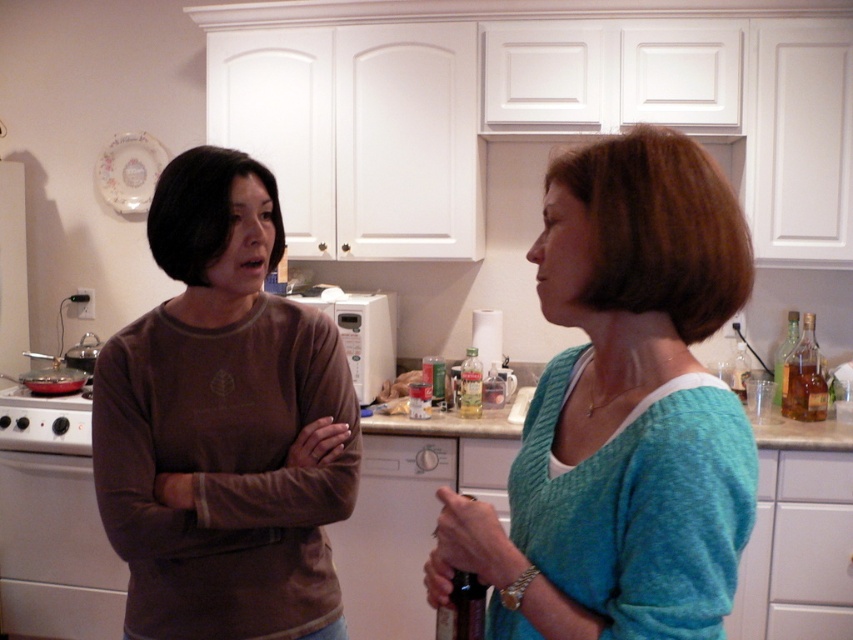
You are trying to decide whether to place a new decorative item on the counter between the teal knitted sweater at center and the brown matte shirt at left. Based on their positions, which object should the decorative item be closer to if you want it to appear centered in the image?

The teal knitted sweater at center is in front of the brown matte shirt at left, so placing the decorative item closer to the teal knitted sweater at center would make it appear centered in the image.

You are standing in the kitchen and want to reach the point marked at coordinates point (563, 508). If your arm can extend 90 centimeters, can you comfortably reach that point without moving your feet?

The point (563, 508) is 87.29 centimeters away from you, so yes, you can comfortably reach it since your arm can extend 90 centimeters, which is slightly longer than the distance required.

You are standing in the kitchen and want to place a small plant between the two points, point (677, 323) and point (209, 532). Which point should the plant be closer to in order to be nearer to the viewer?

The plant should be closer to point (677, 323) because it is nearer to the viewer than point (209, 532).